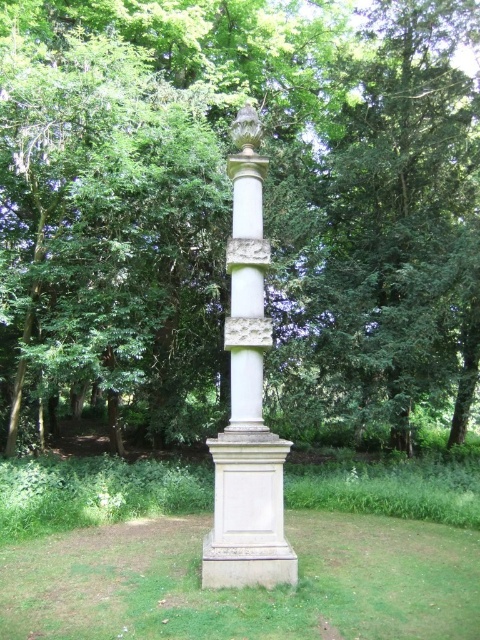
Does green leafy tree at center appear under white stone column at center?

No.

Is the position of green leafy tree at center less distant than that of white stone column at center?

No, it is not.

Locate an element on the screen. This screenshot has height=640, width=480. green leafy tree at center is located at coordinates (229, 211).